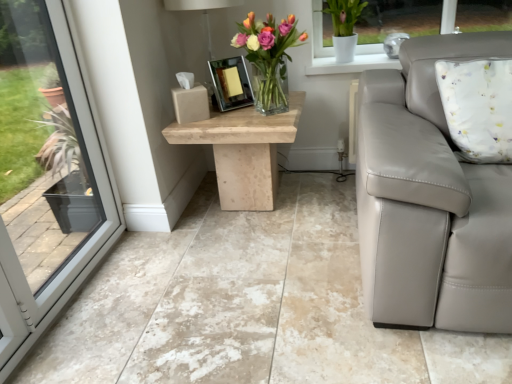
At what (x,y) coordinates should I click in order to perform the action: click on vacant point above beige marble floor at center (from a real-world perspective). Please return your answer as a coordinate pair (x, y). Looking at the image, I should click on (229, 268).